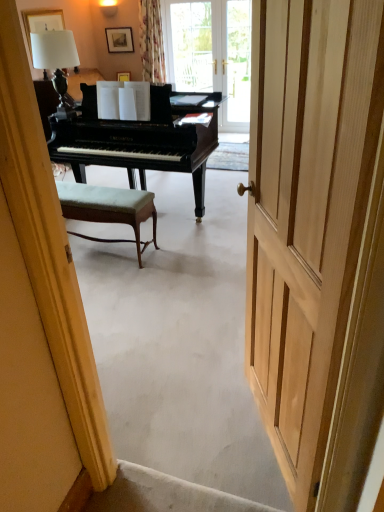
Question: Can you confirm if floral fabric curtain at upper center is smaller than clear glass door at center?

Choices:
 (A) yes
 (B) no

Answer: (B)

Question: Can you confirm if floral fabric curtain at upper center is thinner than clear glass door at center?

Choices:
 (A) no
 (B) yes

Answer: (A)

Question: From the image's perspective, would you say floral fabric curtain at upper center is shown under clear glass door at center?

Choices:
 (A) yes
 (B) no

Answer: (B)

Question: Can you confirm if floral fabric curtain at upper center is wider than clear glass door at center?

Choices:
 (A) no
 (B) yes

Answer: (B)

Question: Can you confirm if floral fabric curtain at upper center is taller than clear glass door at center?

Choices:
 (A) yes
 (B) no

Answer: (B)

Question: Does floral fabric curtain at upper center appear on the right side of clear glass door at center?

Choices:
 (A) yes
 (B) no

Answer: (B)

Question: Does green fabric bench at center turn towards clear glass door at center?

Choices:
 (A) yes
 (B) no

Answer: (A)

Question: Is green fabric bench at center positioned in front of clear glass door at center?

Choices:
 (A) no
 (B) yes

Answer: (B)

Question: Could clear glass door at center be considered to be inside green fabric bench at center?

Choices:
 (A) no
 (B) yes

Answer: (A)

Question: Does green fabric bench at center have a greater height compared to clear glass door at center?

Choices:
 (A) no
 (B) yes

Answer: (A)

Question: From a real-world perspective, is green fabric bench at center under clear glass door at center?

Choices:
 (A) yes
 (B) no

Answer: (A)

Question: Is green fabric bench at center wider than clear glass door at center?

Choices:
 (A) yes
 (B) no

Answer: (A)

Question: From a real-world perspective, is floral fabric curtain at upper center located higher than white fabric lampshade at upper left?

Choices:
 (A) no
 (B) yes

Answer: (A)